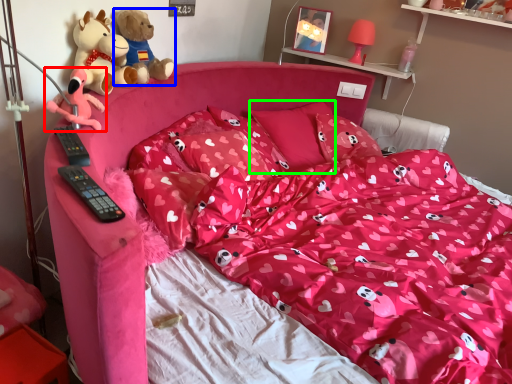
Question: Estimate the real-world distances between objects in this image. Which object is closer to toy (highlighted by a red box), teddy bear (highlighted by a blue box) or pillow (highlighted by a green box)?

Choices:
 (A) teddy bear
 (B) pillow

Answer: (A)